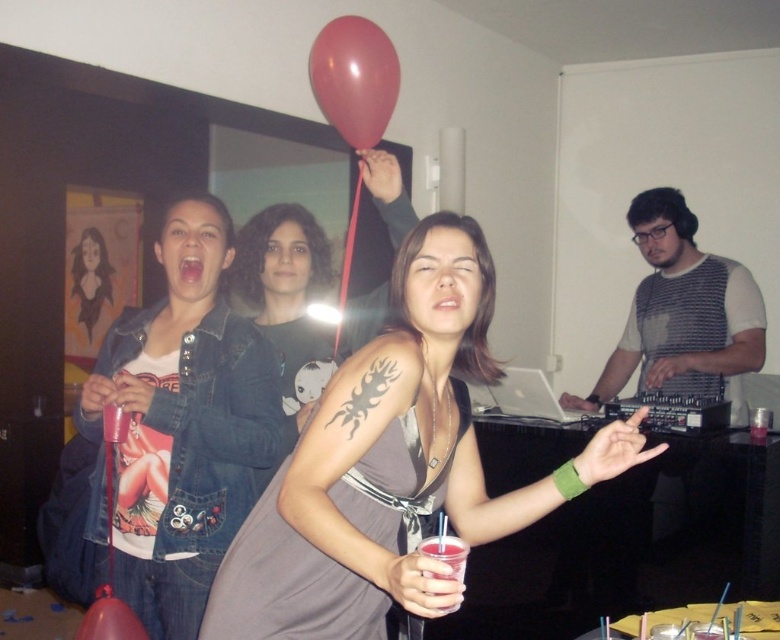
The width and height of the screenshot is (780, 640). What do you see at coordinates (681, 310) in the screenshot?
I see `striped jersey at center` at bounding box center [681, 310].

Which is above, striped jersey at center or translucent plastic cup at lower center?

striped jersey at center is higher up.

Between point (683, 262) and point (424, 573), which one is positioned behind?

Point (683, 262)

This screenshot has height=640, width=780. I want to click on striped jersey at center, so click(681, 310).

Is matte gray dress at center positioned at the back of translucent plastic cup at lower center?

No, it is not.

I want to click on matte gray dress at center, so click(392, 465).

The height and width of the screenshot is (640, 780). Identify the location of matte gray dress at center. (392, 465).

Which of these two, matte gray dress at center or rubber balloon at upper center, stands shorter?

rubber balloon at upper center

Locate an element on the screen. The image size is (780, 640). matte gray dress at center is located at coordinates [392, 465].

The width and height of the screenshot is (780, 640). Identify the location of matte gray dress at center. pos(392,465).